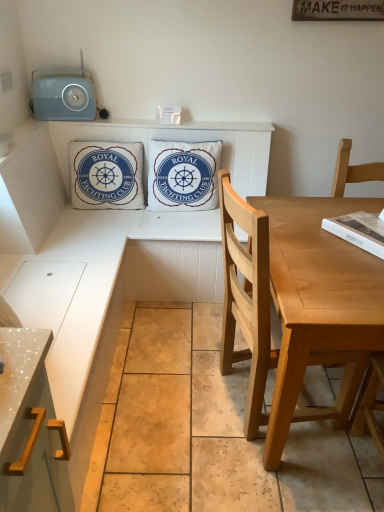
Locate an element on the screen. Image resolution: width=384 pixels, height=512 pixels. free spot to the left of light wood chair at right is located at coordinates (163, 415).